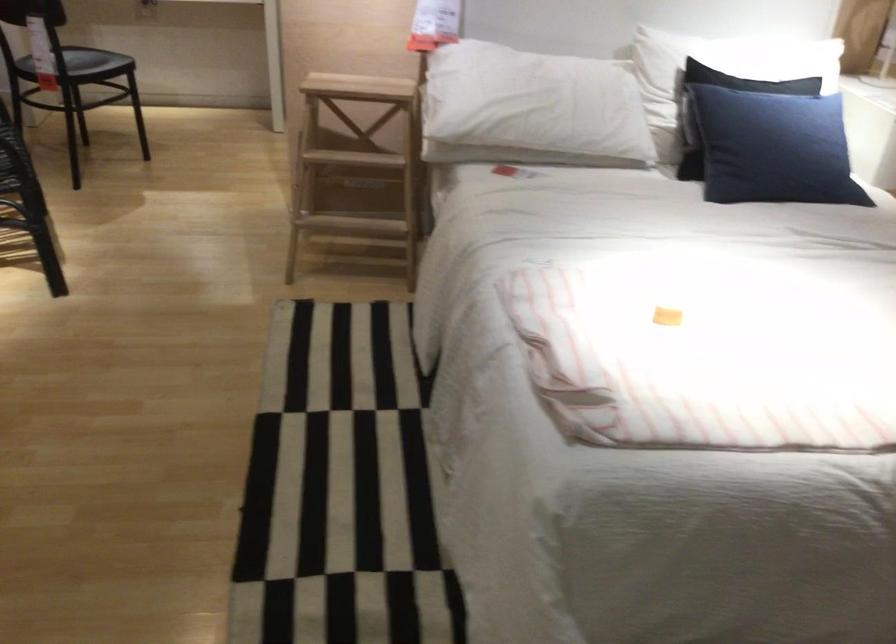
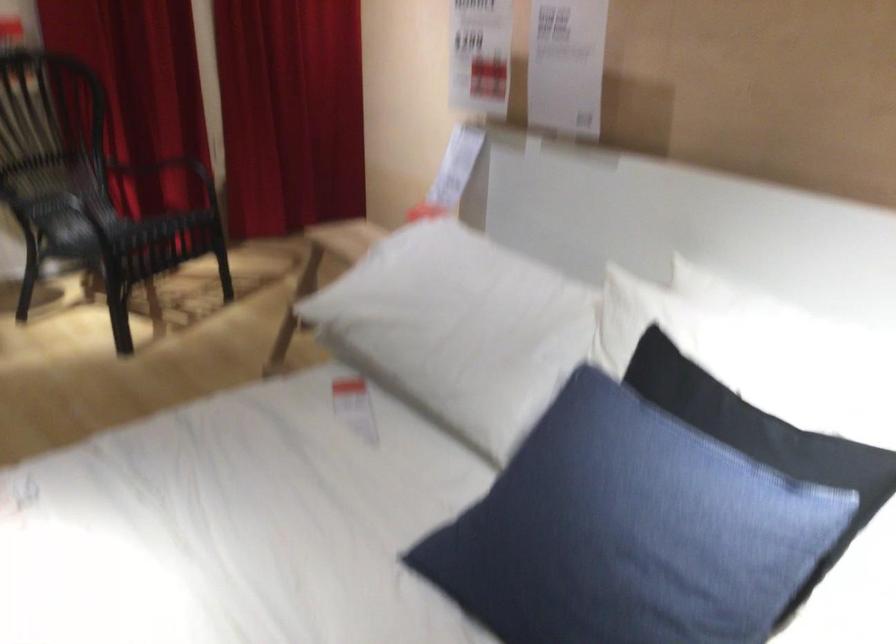
Question: I am providing you with two images of the same scene from different viewpoints. Which of the following objects are not visible in image2?

Choices:
 (A) blue pillow
 (B) wooden step stool
 (C) chair armrest
 (D) yellow soap bottle

Answer: (B)